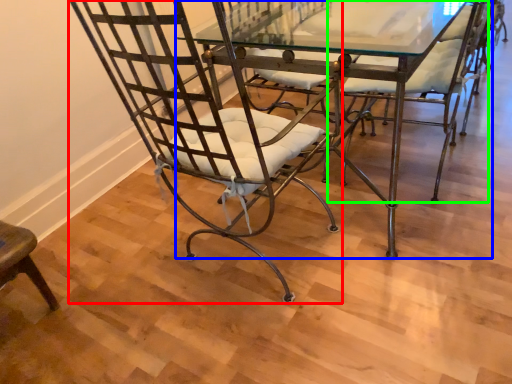
Question: Considering the real-world distances, which object is closest to chair (highlighted by a red box)? table (highlighted by a blue box) or chair (highlighted by a green box).

Choices:
 (A) table
 (B) chair

Answer: (B)